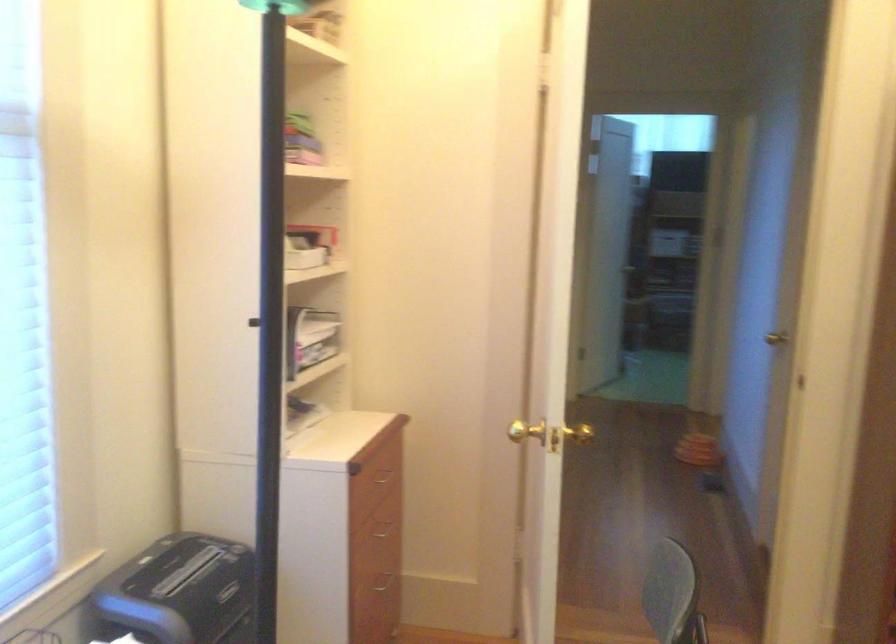
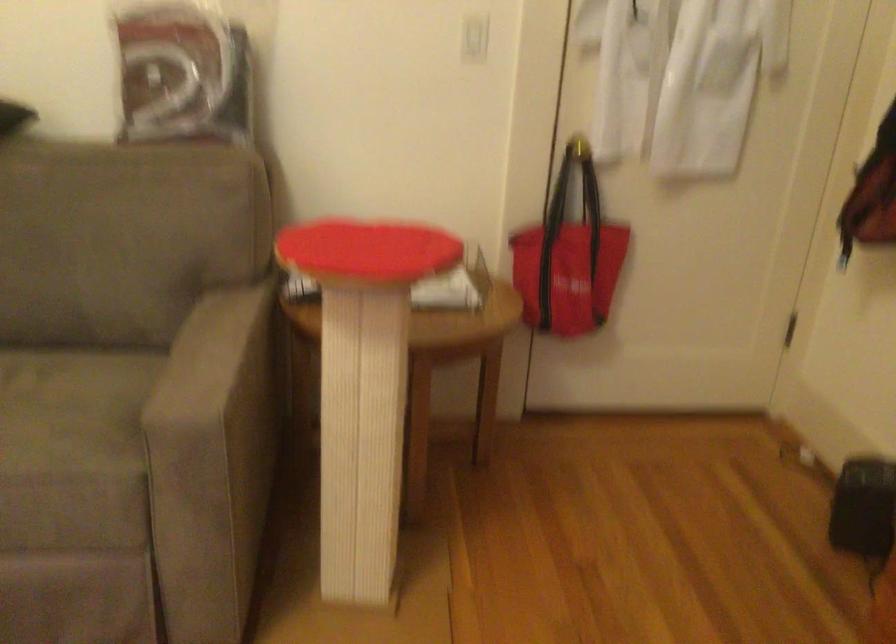
The images are taken continuously from a first-person perspective. In which direction is your viewpoint rotating?

The camera rotated toward right-down.